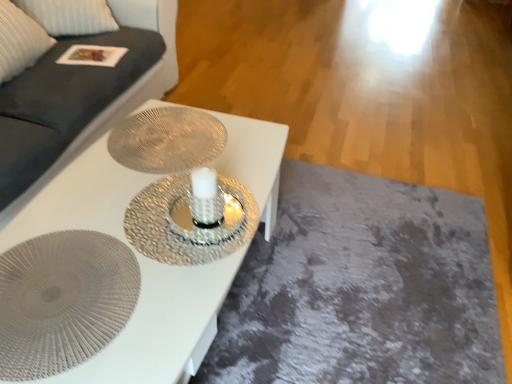
Where is `free spot above white textured table at center (from a real-world perspective)`? The width and height of the screenshot is (512, 384). free spot above white textured table at center (from a real-world perspective) is located at coordinates (143, 204).